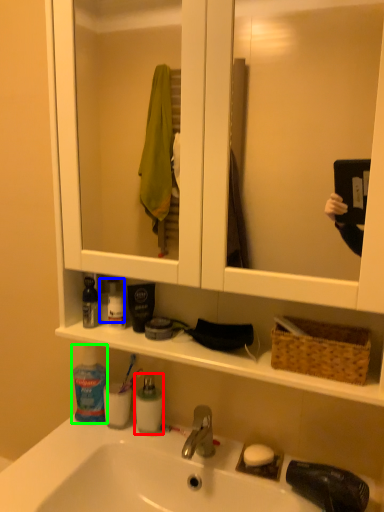
Question: Considering the real-world distances, which object is closest to cleaning product (highlighted by a red box)? mouthwash (highlighted by a blue box) or toiletry (highlighted by a green box).

Choices:
 (A) mouthwash
 (B) toiletry

Answer: (B)